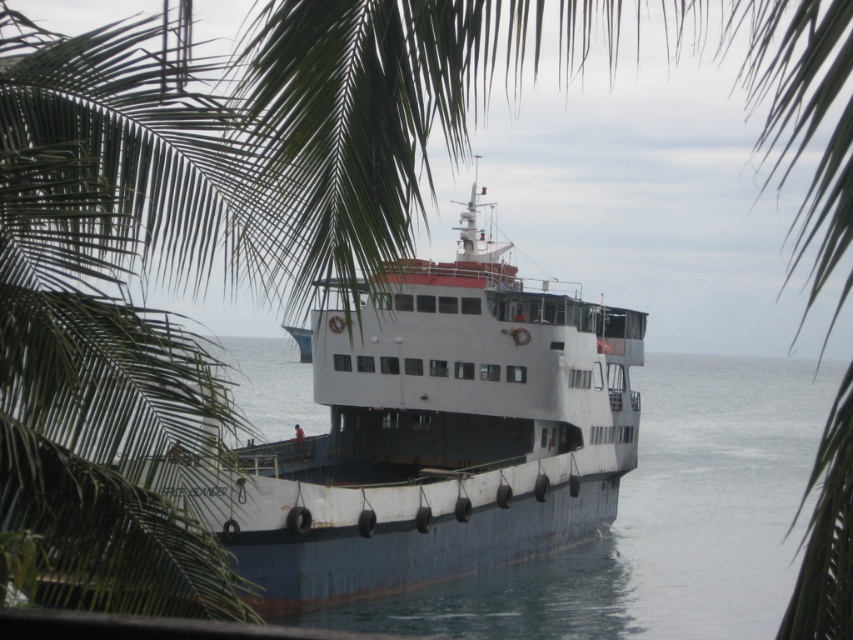
What do you see at coordinates (434, 435) in the screenshot?
I see `white matte boat at center` at bounding box center [434, 435].

Measure the distance between white matte boat at center and camera.

A distance of 60.05 feet exists between white matte boat at center and camera.

Who is more distant from viewer, (271,524) or (479,618)?

Positioned behind is point (479,618).

Locate an element on the screen. This screenshot has width=853, height=640. white matte boat at center is located at coordinates (434, 435).